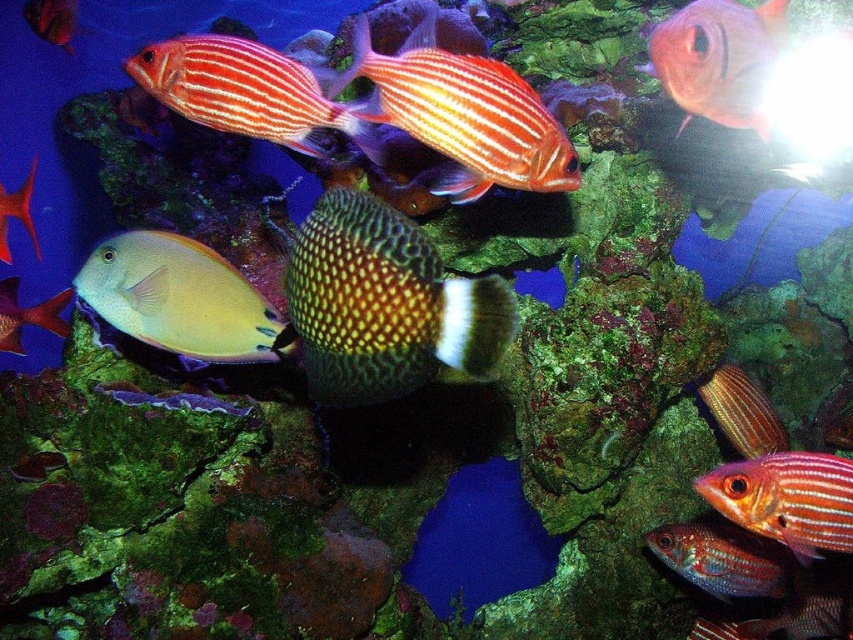
Question: Estimate the real-world distances between objects in this image. Which object is closer to the shiny gold fish at center?

Choices:
 (A) shiny metallic fish at lower right
 (B) yellow matte fish at center-left
 (C) matte yellow fish at center
 (D) shiny red fish at right

Answer: (A)

Question: Does shiny gold fish at center lie in front of matte black fish at upper left?

Choices:
 (A) no
 (B) yes

Answer: (B)

Question: Does green textured fish at center lie behind matte black fish at upper left?

Choices:
 (A) no
 (B) yes

Answer: (A)

Question: Which object is positioned closest to the shiny red fish at right?

Choices:
 (A) shiny gold fish at center
 (B) shiny pink fish at upper right
 (C) yellow matte fish at center-left

Answer: (B)

Question: Which point is farther to the camera?

Choices:
 (A) pyautogui.click(x=44, y=33)
 (B) pyautogui.click(x=813, y=532)
 (C) pyautogui.click(x=770, y=449)

Answer: (A)

Question: Is orange striped fish at upper center to the left of shiny red fish at right from the viewer's perspective?

Choices:
 (A) yes
 (B) no

Answer: (A)